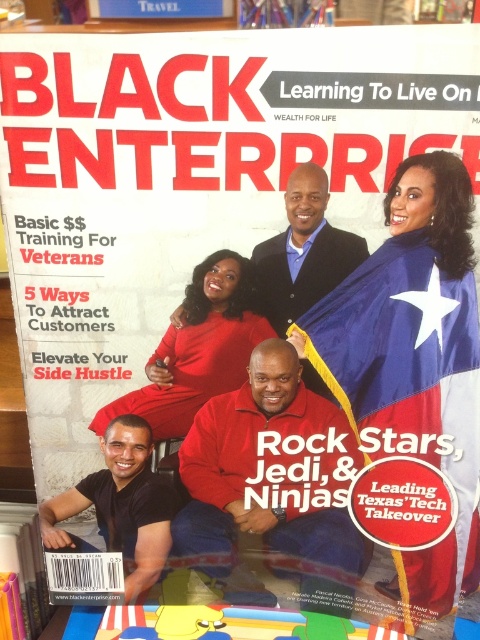
You are a fashion designer analyzing the magazine cover. You notice the red matte sweater at center and the smooth black suit at center. Which clothing item is positioned to the right side of the other?

The red matte sweater at center is to the right of the smooth black suit at center.

Looking at the magazine cover, there are two red items at the center. Which one is bigger between the red matte sweater at center and the red matte dress at center?

The red matte sweater at center is larger in size than the red matte dress at center.

Looking at the magazine cover, there are two red items at the center. Which one has a greater width between the red matte sweater at center and the red matte dress at center?

The red matte sweater at center has a greater width than the red matte dress at center according to the description provided.